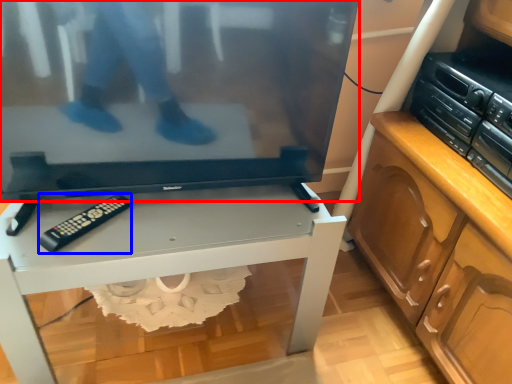
Question: Which point is further to the camera, television (highlighted by a red box) or control (highlighted by a blue box)?

Choices:
 (A) television
 (B) control

Answer: (B)